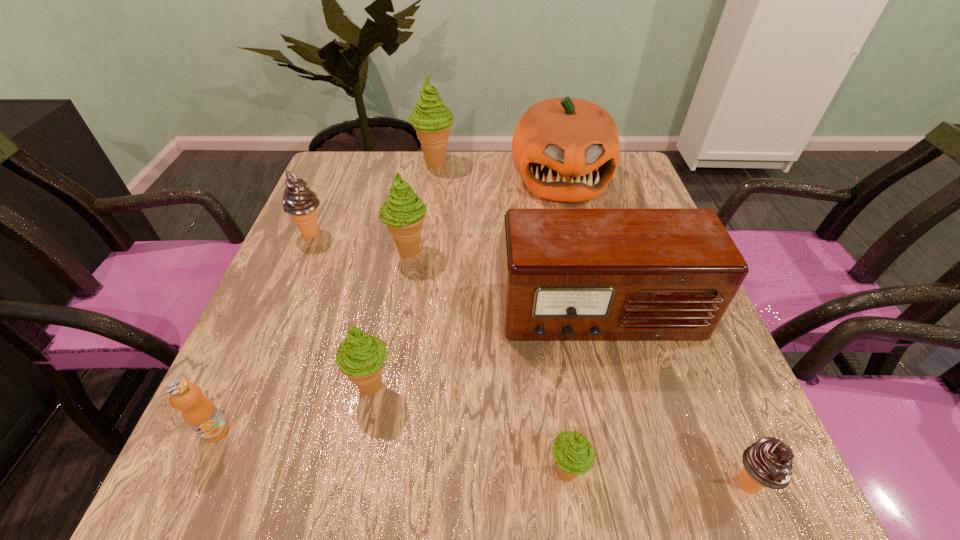
Locate an element on the screen. Image resolution: width=960 pixels, height=540 pixels. icecream that is positioned at the right edge is located at coordinates (767, 463).

Find the location of a particular element. The image size is (960, 540). object that is at the far right corner is located at coordinates (566, 149).

Find the location of a particular element. object that is positioned at the near right corner is located at coordinates (767, 463).

This screenshot has height=540, width=960. I want to click on vacant space at the far edge, so click(498, 193).

This screenshot has width=960, height=540. I want to click on free region at the near edge of the desktop, so click(x=542, y=496).

This screenshot has width=960, height=540. Find the location of `free spot at the left edge of the desktop`. free spot at the left edge of the desktop is located at coordinates tap(361, 227).

In the image, there is a desktop. What are the coordinates of `vacant space at the far left corner` in the screenshot? It's located at (356, 196).

Where is `free space at the far right corner of the desktop`? Image resolution: width=960 pixels, height=540 pixels. free space at the far right corner of the desktop is located at coordinates (607, 195).

The height and width of the screenshot is (540, 960). Find the location of `free space between the third nearest green icecream and the fourth farthest icecream`. free space between the third nearest green icecream and the fourth farthest icecream is located at coordinates (390, 318).

This screenshot has width=960, height=540. In order to click on free space between the second nearest green icecream and the second farthest green icecream in this screenshot , I will do `click(390, 318)`.